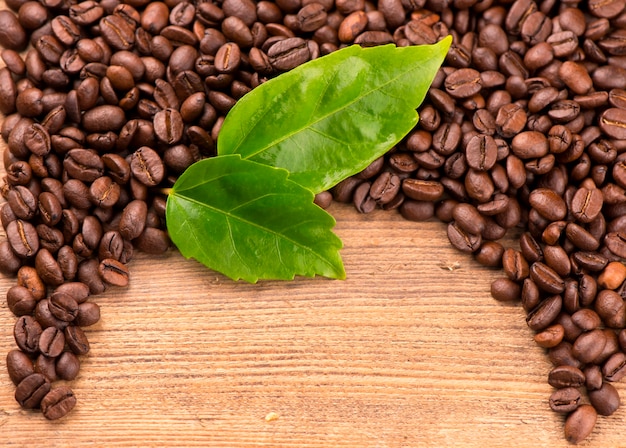
Where is `countertop`? countertop is located at coordinates (284, 331).